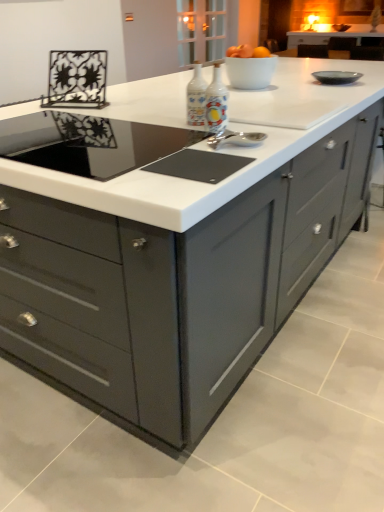
Describe the element at coordinates (196, 97) in the screenshot. I see `matte glass bottles at center, positioned as the first appliance in left-to-right order` at that location.

Find the location of a particular element. The width and height of the screenshot is (384, 512). porcelain bottles at center, positioned as the first appliance in right-to-left order is located at coordinates (216, 103).

Does matte gray cabinet at right come behind porcelain bottles at center, positioned as the first appliance in right-to-left order?

Yes, matte gray cabinet at right is further from the camera.

Is matte gray cabinet at right positioned with its back to porcelain bottles at center, which is the second appliance from left to right?

matte gray cabinet at right is not turned away from porcelain bottles at center, which is the second appliance from left to right.

From a real-world perspective, which object rests below the other?

matte gray cabinet at right is physically lower.

Is matte gray cabinet at right at the left side of porcelain bottles at center, positioned as the first appliance in right-to-left order?

No, matte gray cabinet at right is not to the left of porcelain bottles at center, positioned as the first appliance in right-to-left order.

From a real-world perspective, is porcelain bottles at center, which is the second appliance from left to right, above or below matte gray cabinet at right?

porcelain bottles at center, which is the second appliance from left to right, is above matte gray cabinet at right.

From the image's perspective, which object appears higher, porcelain bottles at center, which is the second appliance from left to right, or matte gray cabinet at right?

matte gray cabinet at right.

Is porcelain bottles at center, which is the second appliance from left to right, further to the viewer compared to matte gray cabinet at right?

No.

Considering the sizes of objects black glass cooktop at center and matte gray cabinet at right in the image provided, who is wider, black glass cooktop at center or matte gray cabinet at right?

black glass cooktop at center.

Considering the sizes of objects black glass cooktop at center and matte gray cabinet at right in the image provided, who is taller, black glass cooktop at center or matte gray cabinet at right?

matte gray cabinet at right.

Is matte gray cabinet at right surrounded by black glass cooktop at center?

No, matte gray cabinet at right is not inside black glass cooktop at center.

Is point (97, 149) behind point (360, 142)?

No.

Can you confirm if matte glass bottles at center, the 2th appliance when ordered from right to left, is thinner than porcelain bottles at center, which is the second appliance from left to right?

No, matte glass bottles at center, the 2th appliance when ordered from right to left, is not thinner than porcelain bottles at center, which is the second appliance from left to right.

Who is bigger, matte glass bottles at center, the 2th appliance when ordered from right to left, or porcelain bottles at center, positioned as the first appliance in right-to-left order?

Bigger between the two is matte glass bottles at center, the 2th appliance when ordered from right to left.

Is matte glass bottles at center, positioned as the first appliance in left-to-right order, beside porcelain bottles at center, which is the second appliance from left to right?

Yes, matte glass bottles at center, positioned as the first appliance in left-to-right order, is with porcelain bottles at center, which is the second appliance from left to right.

From the image's perspective, which object appears higher, matte glass bottles at center, the 2th appliance when ordered from right to left, or porcelain bottles at center, which is the second appliance from left to right?

matte glass bottles at center, the 2th appliance when ordered from right to left, is shown above in the image.

Could you tell me if porcelain bottles at center, positioned as the first appliance in right-to-left order, is turned towards matte glass bottles at center, positioned as the first appliance in left-to-right order?

No, porcelain bottles at center, positioned as the first appliance in right-to-left order, is not turned towards matte glass bottles at center, positioned as the first appliance in left-to-right order.

Can you confirm if porcelain bottles at center, positioned as the first appliance in right-to-left order, is positioned to the left of matte glass bottles at center, positioned as the first appliance in left-to-right order?

No.

From the image's perspective, which one is positioned higher, porcelain bottles at center, positioned as the first appliance in right-to-left order, or matte glass bottles at center, positioned as the first appliance in left-to-right order?

matte glass bottles at center, positioned as the first appliance in left-to-right order, appears higher in the image.

Is point (222, 115) behind point (195, 102)?

No, it is not.

Is porcelain bottles at center, positioned as the first appliance in right-to-left order, a part of black glass cooktop at center?

No, porcelain bottles at center, positioned as the first appliance in right-to-left order, is located outside of black glass cooktop at center.

From the image's perspective, is black glass cooktop at center located above or below porcelain bottles at center, which is the second appliance from left to right?

From the image's perspective, black glass cooktop at center appears below porcelain bottles at center, which is the second appliance from left to right.

From a real-world perspective, is black glass cooktop at center positioned under porcelain bottles at center, which is the second appliance from left to right, based on gravity?

Correct, in the physical world, black glass cooktop at center is lower than porcelain bottles at center, which is the second appliance from left to right.

Considering the sizes of objects black glass cooktop at center and porcelain bottles at center, which is the second appliance from left to right, in the image provided, who is thinner, black glass cooktop at center or porcelain bottles at center, which is the second appliance from left to right,?

With smaller width is porcelain bottles at center, which is the second appliance from left to right.

From a real-world perspective, does matte gray cabinet at right stand above black glass cooktop at center?

No.

Between point (338, 231) and point (81, 158), which one is positioned behind?

The point (338, 231) is farther.

Consider the image. Does matte gray cabinet at right have a greater width compared to black glass cooktop at center?

No, matte gray cabinet at right is not wider than black glass cooktop at center.

Is matte gray cabinet at right turned away from black glass cooktop at center?

That's not correct — matte gray cabinet at right is not looking away from black glass cooktop at center.

Locate an element on the screen. The image size is (384, 512). cabinetry to the right of porcelain bottles at center, positioned as the first appliance in right-to-left order is located at coordinates (360, 170).

I want to click on cabinetry behind the porcelain bottles at center, positioned as the first appliance in right-to-left order, so click(360, 170).

Based on their spatial positions, is matte gray cabinet at right or porcelain bottles at center, which is the second appliance from left to right, closer to matte glass bottles at center, positioned as the first appliance in left-to-right order?

porcelain bottles at center, which is the second appliance from left to right, lies closer to matte glass bottles at center, positioned as the first appliance in left-to-right order, than the other object.

When comparing their distances from porcelain bottles at center, positioned as the first appliance in right-to-left order, does matte gray cabinet at right or matte glass bottles at center, positioned as the first appliance in left-to-right order, seem further?

matte gray cabinet at right is further to porcelain bottles at center, positioned as the first appliance in right-to-left order.

Looking at this image, from the image, which object appears to be nearer to matte glass bottles at center, the 2th appliance when ordered from right to left, black glass cooktop at center or porcelain bottles at center, positioned as the first appliance in right-to-left order?

Based on the image, porcelain bottles at center, positioned as the first appliance in right-to-left order, appears to be nearer to matte glass bottles at center, the 2th appliance when ordered from right to left.

Looking at the image, which one is located closer to black glass cooktop at center, matte glass bottles at center, the 2th appliance when ordered from right to left, or porcelain bottles at center, which is the second appliance from left to right?

Among the two, porcelain bottles at center, which is the second appliance from left to right, is located nearer to black glass cooktop at center.

Based on their spatial positions, is matte gray cabinet at right or matte glass bottles at center, the 2th appliance when ordered from right to left, closer to black glass cooktop at center?

The object closer to black glass cooktop at center is matte glass bottles at center, the 2th appliance when ordered from right to left.

When comparing their distances from porcelain bottles at center, positioned as the first appliance in right-to-left order, does matte glass bottles at center, positioned as the first appliance in left-to-right order, or black glass cooktop at center seem closer?

Based on the image, matte glass bottles at center, positioned as the first appliance in left-to-right order, appears to be nearer to porcelain bottles at center, positioned as the first appliance in right-to-left order.

From the image, which object appears to be farther from black glass cooktop at center, matte gray cabinet at right or porcelain bottles at center, which is the second appliance from left to right?

matte gray cabinet at right is further to black glass cooktop at center.

Based on their spatial positions, is porcelain bottles at center, which is the second appliance from left to right, or black glass cooktop at center further from matte glass bottles at center, the 2th appliance when ordered from right to left?

black glass cooktop at center lies further to matte glass bottles at center, the 2th appliance when ordered from right to left, than the other object.

Locate an element on the screen. Image resolution: width=384 pixels, height=512 pixels. appliance located between matte glass bottles at center, positioned as the first appliance in left-to-right order, and matte gray cabinet at right in the left-right direction is located at coordinates (216, 103).

Locate an element on the screen. appliance situated between black glass cooktop at center and porcelain bottles at center, positioned as the first appliance in right-to-left order, from left to right is located at coordinates (196, 97).